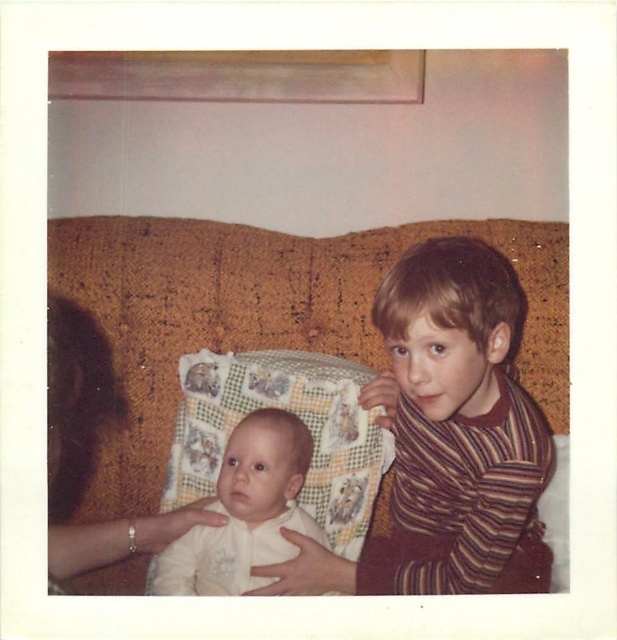
Looking at this image, between brown textured couch at center and quilted fabric pillow at center, which one appears on the right side from the viewer's perspective?

Positioned to the right is brown textured couch at center.

Who is lower down, brown textured couch at center or quilted fabric pillow at center?

quilted fabric pillow at center

Between point (170, 378) and point (257, 388), which one is positioned behind?

The point (170, 378) is behind.

The image size is (617, 640). I want to click on brown textured couch at center, so 233,326.

Does brown textured couch at center have a larger size compared to striped knit sweater at right?

Indeed, brown textured couch at center has a larger size compared to striped knit sweater at right.

Between brown textured couch at center and striped knit sweater at right, which one has less height?

Standing shorter between the two is striped knit sweater at right.

Between point (125, 248) and point (540, 483), which one is positioned behind?

Positioned behind is point (125, 248).

Find the location of a particular element. brown textured couch at center is located at coordinates (233, 326).

Who is shorter, striped knit sweater at right or smooth skin hand at lower left?

A: Standing shorter between the two is smooth skin hand at lower left.

Can you confirm if striped knit sweater at right is taller than smooth skin hand at lower left?

Indeed, striped knit sweater at right has a greater height compared to smooth skin hand at lower left.

This screenshot has width=617, height=640. In order to click on striped knit sweater at right in this screenshot , I will do `click(457, 428)`.

Locate an element on the screen. This screenshot has width=617, height=640. striped knit sweater at right is located at coordinates (457, 428).